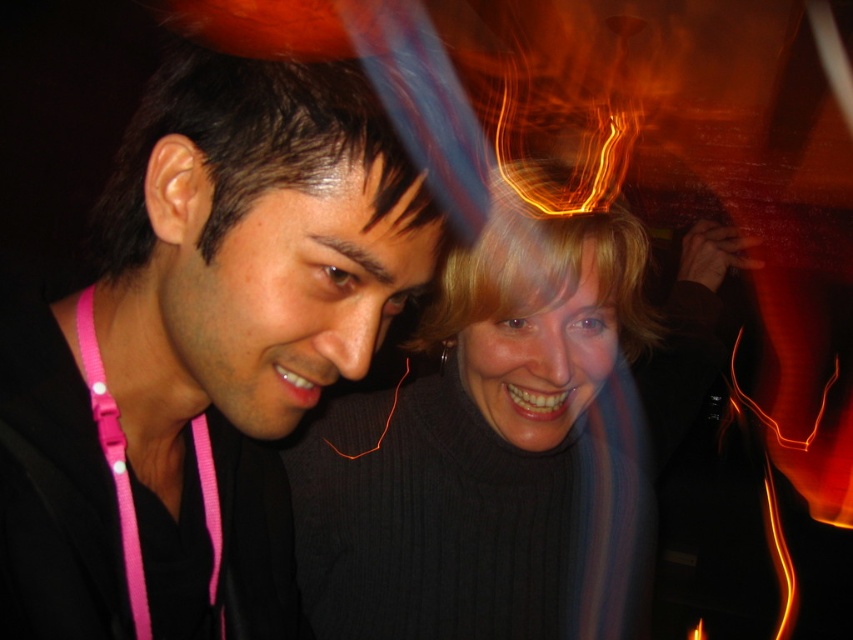
Is point (198, 461) farther from camera compared to point (534, 344)?

No, (198, 461) is closer to viewer.

Is black matte jacket at left positioned behind black ribbed sweater at center?

That is False.

The width and height of the screenshot is (853, 640). What are the coordinates of `black matte jacket at left` in the screenshot? It's located at (199, 353).

Which is more to the left, black matte jacket at left or pink fabric lanyard at left?

Positioned to the left is pink fabric lanyard at left.

At what (x,y) coordinates should I click in order to perform the action: click on black matte jacket at left. Please return your answer as a coordinate pair (x, y). The height and width of the screenshot is (640, 853). Looking at the image, I should click on (199, 353).

Find the location of `black matte jacket at left`. black matte jacket at left is located at coordinates (199, 353).

What do you see at coordinates (520, 445) in the screenshot? I see `black ribbed sweater at center` at bounding box center [520, 445].

Consider the image. Can you confirm if black ribbed sweater at center is smaller than pink fabric lanyard at left?

Result: Actually, black ribbed sweater at center might be larger than pink fabric lanyard at left.

Between point (689, 250) and point (91, 378), which one is positioned in front?

Positioned in front is point (91, 378).

You are a GUI agent. You are given a task and a screenshot of the screen. Output one action in this format:
    pyautogui.click(x=<x>, y=<y>)
    Task: Click on the black ribbed sweater at center
    The image size is (853, 640).
    Given the screenshot: What is the action you would take?
    [x=520, y=445]